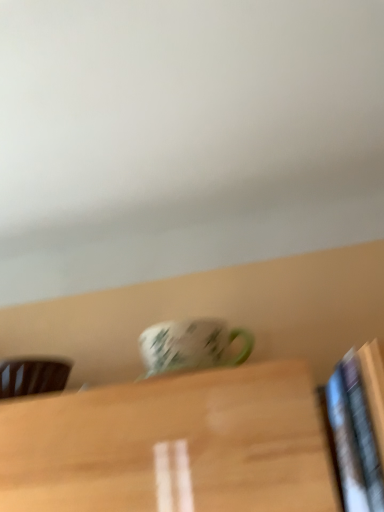
Question: Is green matte mug at center aimed at brown wood chair at left?

Choices:
 (A) yes
 (B) no

Answer: (B)

Question: Considering the relative sizes of green matte mug at center and brown wood chair at left in the image provided, is green matte mug at center taller than brown wood chair at left?

Choices:
 (A) yes
 (B) no

Answer: (A)

Question: From the image's perspective, is green matte mug at center beneath brown wood chair at left?

Choices:
 (A) yes
 (B) no

Answer: (B)

Question: Is green matte mug at center touching brown wood chair at left?

Choices:
 (A) yes
 (B) no

Answer: (B)

Question: Is green matte mug at center wider than brown wood chair at left?

Choices:
 (A) no
 (B) yes

Answer: (A)

Question: Is green matte mug at center oriented away from brown wood chair at left?

Choices:
 (A) yes
 (B) no

Answer: (B)

Question: From a real-world perspective, is brown wood chair at left located beneath green matte mug at center?

Choices:
 (A) no
 (B) yes

Answer: (B)

Question: Is brown wood chair at left shorter than green matte mug at center?

Choices:
 (A) yes
 (B) no

Answer: (A)

Question: Is brown wood chair at left positioned beyond the bounds of green matte mug at center?

Choices:
 (A) no
 (B) yes

Answer: (B)

Question: Does brown wood chair at left lie behind green matte mug at center?

Choices:
 (A) yes
 (B) no

Answer: (A)

Question: From a real-world perspective, is brown wood chair at left on top of green matte mug at center?

Choices:
 (A) no
 (B) yes

Answer: (A)

Question: Is brown wood chair at left oriented towards green matte mug at center?

Choices:
 (A) no
 (B) yes

Answer: (A)

Question: In the image, is green matte mug at center on the left side or the right side of brown wood chair at left?

Choices:
 (A) left
 (B) right

Answer: (B)